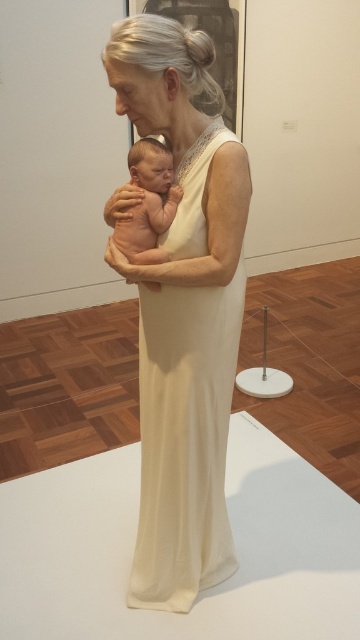
You are an art curator examining the sculpture. You need to determine the spatial relationship between the two central elements. Is the white silk dress at center positioned above or below the smooth skin baby at center?

The white silk dress at center is below the smooth skin baby at center, as stated in the description.

You are an art conservator examining the statue from a distance. You notice two points on the statue, one at point (203, 152) and the other at point (172, 173). Which point is closer to you?

Point (203, 152) is closer to the viewer than point (172, 173).